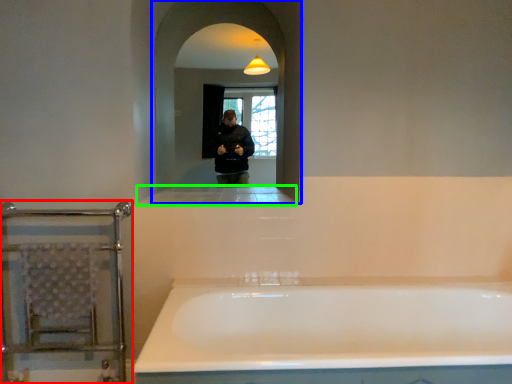
Question: Which object is the farthest from balustrade (highlighted by a red box)? Choose among these: mirror (highlighted by a blue box) or ledge (highlighted by a green box).

Choices:
 (A) mirror
 (B) ledge

Answer: (A)